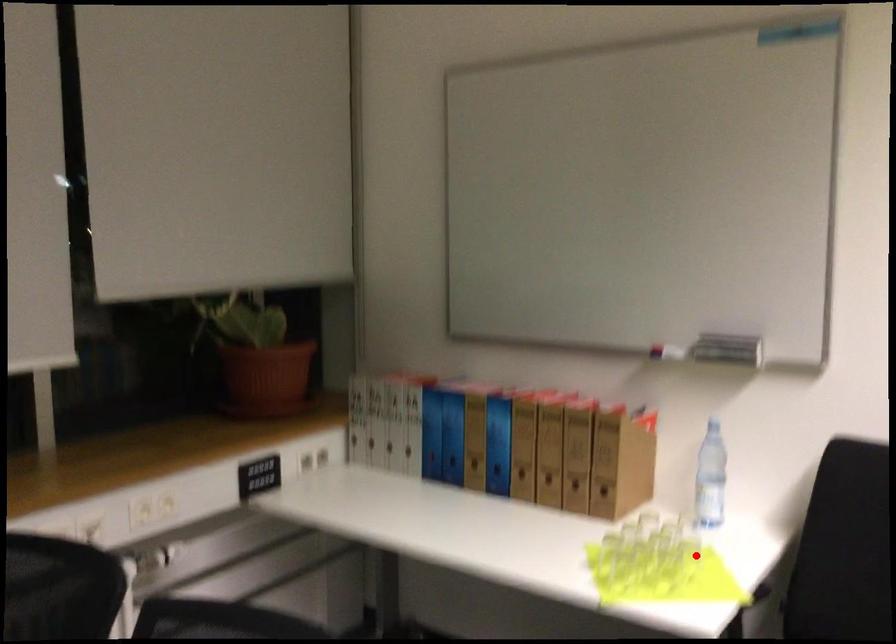
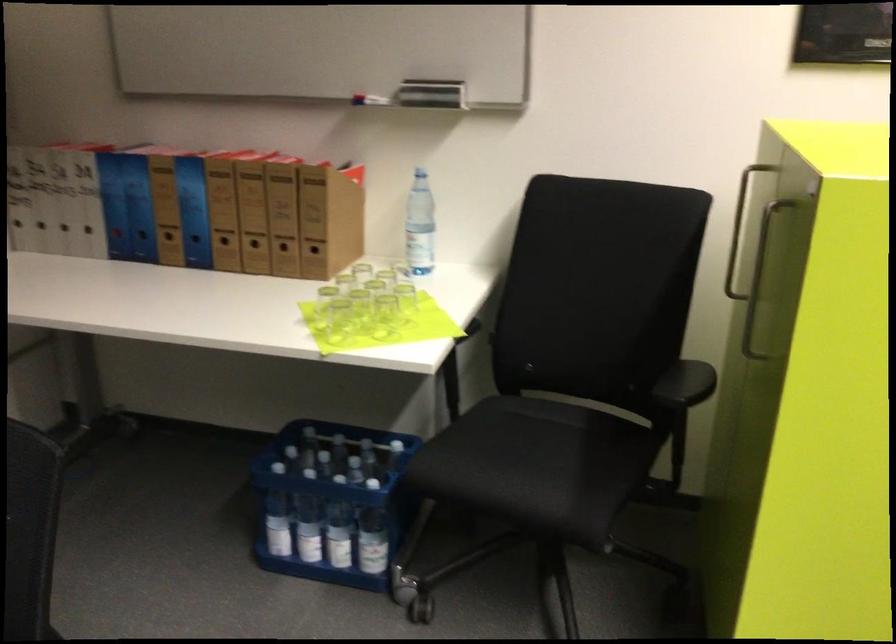
Locate, in the second image, the point that corresponds to the highlighted location in the first image.

(405, 299)